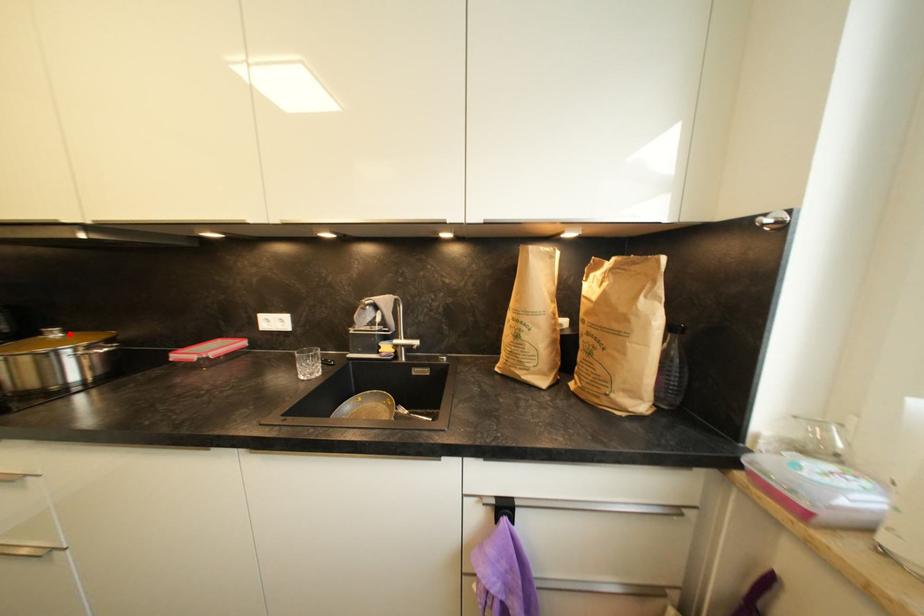
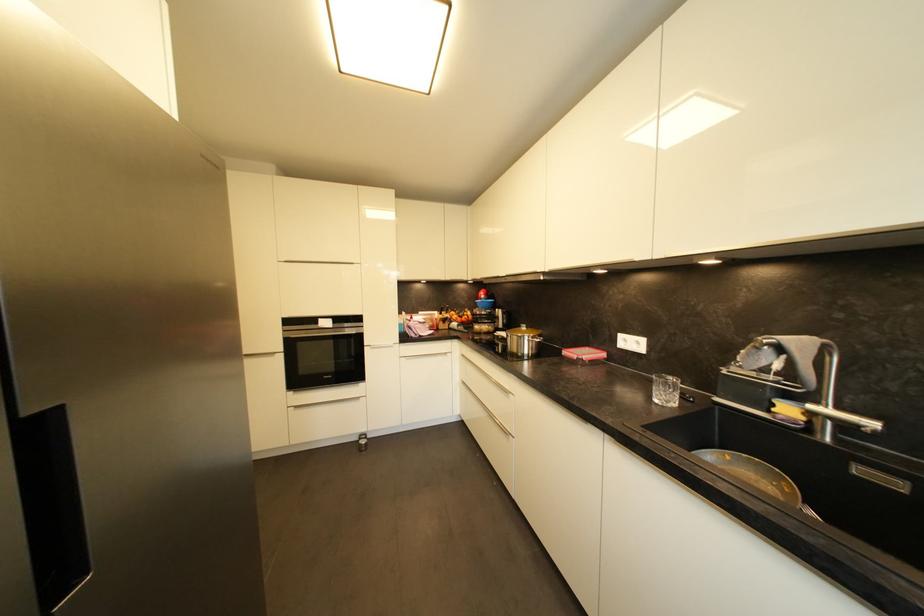
Question: I am providing you with two images of the same scene from different viewpoints. A red point is marked on the first image. At the location where the point appears in image 1, is it still visible in image 2?

Choices:
 (A) Yes
 (B) No

Answer: (A)